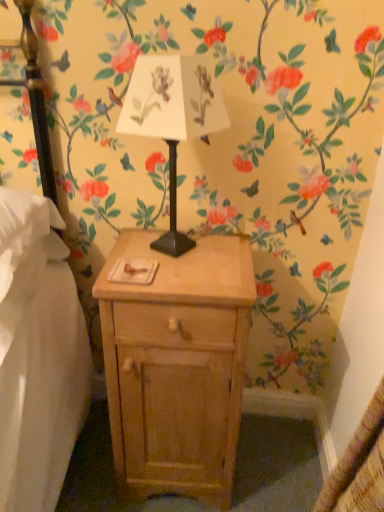
Question: From the image's perspective, is light wood nightstand at center on white paper lampshade at center?

Choices:
 (A) yes
 (B) no

Answer: (B)

Question: Could you tell me if light wood nightstand at center is turned towards white paper lampshade at center?

Choices:
 (A) yes
 (B) no

Answer: (B)

Question: From the image's perspective, would you say light wood nightstand at center is shown under white paper lampshade at center?

Choices:
 (A) no
 (B) yes

Answer: (B)

Question: Is white paper lampshade at center located within light wood nightstand at center?

Choices:
 (A) no
 (B) yes

Answer: (A)

Question: Considering the relative positions of light wood nightstand at center and white paper lampshade at center in the image provided, is light wood nightstand at center to the right of white paper lampshade at center from the viewer's perspective?

Choices:
 (A) no
 (B) yes

Answer: (B)

Question: Can you confirm if light wood nightstand at center is positioned to the left of white paper lampshade at center?

Choices:
 (A) no
 (B) yes

Answer: (A)

Question: Is there a large distance between white paper lampshade at center and light wood nightstand at center?

Choices:
 (A) yes
 (B) no

Answer: (B)

Question: Is white paper lampshade at center looking in the opposite direction of light wood nightstand at center?

Choices:
 (A) yes
 (B) no

Answer: (B)

Question: Is white paper lampshade at center positioned behind light wood nightstand at center?

Choices:
 (A) yes
 (B) no

Answer: (B)

Question: Is white paper lampshade at center not inside light wood nightstand at center?

Choices:
 (A) yes
 (B) no

Answer: (A)

Question: Is white paper lampshade at center to the left of light wood nightstand at center from the viewer's perspective?

Choices:
 (A) yes
 (B) no

Answer: (A)

Question: From a real-world perspective, is white paper lampshade at center over light wood nightstand at center?

Choices:
 (A) yes
 (B) no

Answer: (A)

Question: In terms of height, does white paper lampshade at center look taller or shorter compared to light wood nightstand at center?

Choices:
 (A) short
 (B) tall

Answer: (A)